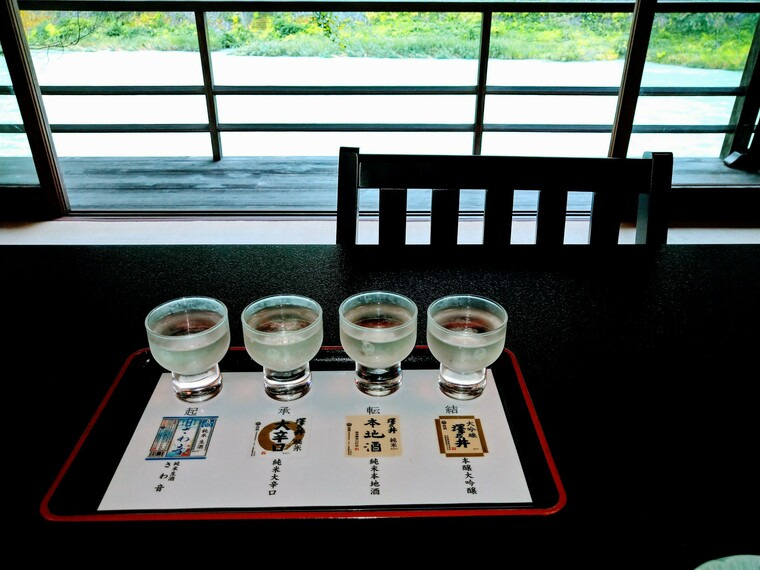
I want to click on empty space to the left of tray, so click(39, 412).